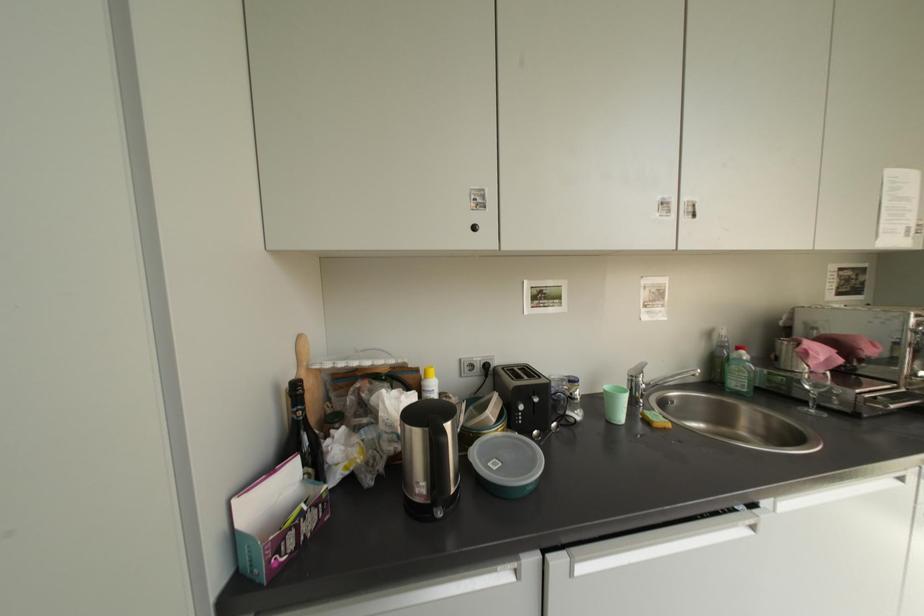
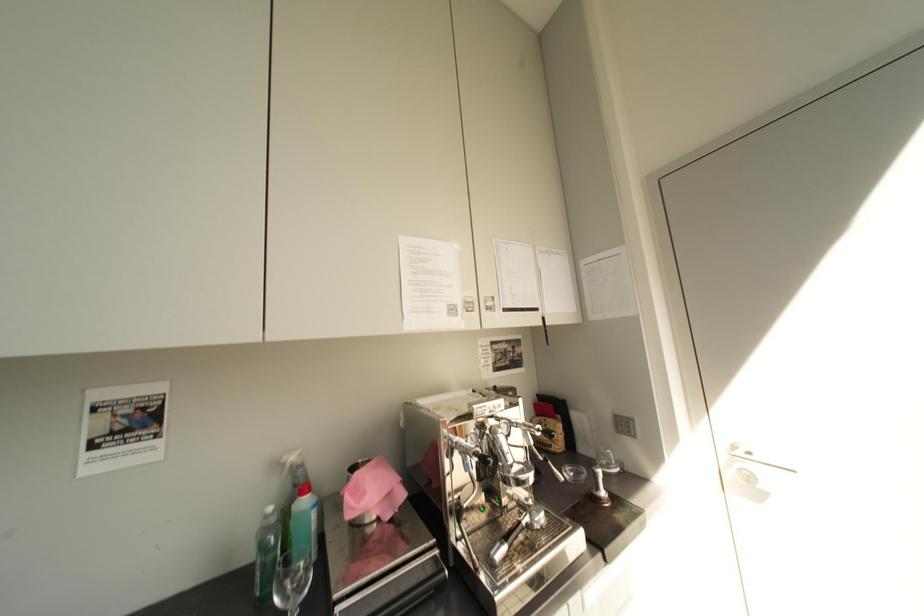
Question: Which direction would the cameraman need to move to produce the second image? Reply with the corresponding letter.

Choices:
 (A) Left
 (B) Right
 (C) Forward
 (D) Backward

Answer: (B)